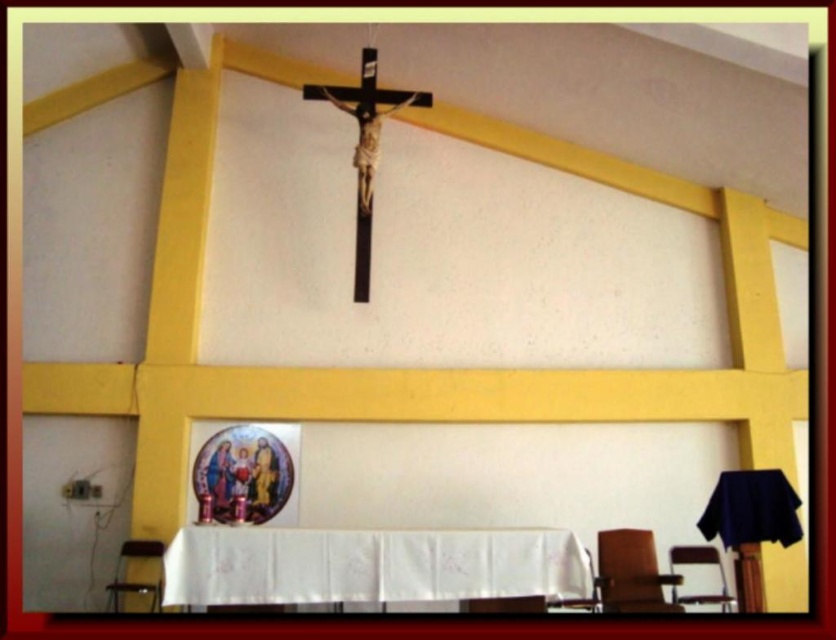
Question: Which point appears farthest from the camera in this image?

Choices:
 (A) (709, 556)
 (B) (460, 598)
 (C) (139, 557)

Answer: (C)

Question: Among these points, which one is nearest to the camera?

Choices:
 (A) [x=128, y=548]
 (B) [x=682, y=548]
 (C) [x=651, y=593]

Answer: (C)

Question: Is white cloth-covered table at lower center thinner than wooden chair at lower left?

Choices:
 (A) yes
 (B) no

Answer: (B)

Question: Is white cloth-covered table at lower center wider than brown wooden chair at lower center?

Choices:
 (A) no
 (B) yes

Answer: (B)

Question: Which of the following is the farthest from the observer?

Choices:
 (A) white cloth-covered table at lower center
 (B) wooden chair at lower left
 (C) brown leather chair at lower right
 (D) metallic silver chair at lower right

Answer: (D)

Question: Can you confirm if white cloth-covered table at lower center is bigger than wooden chair at lower left?

Choices:
 (A) yes
 (B) no

Answer: (A)